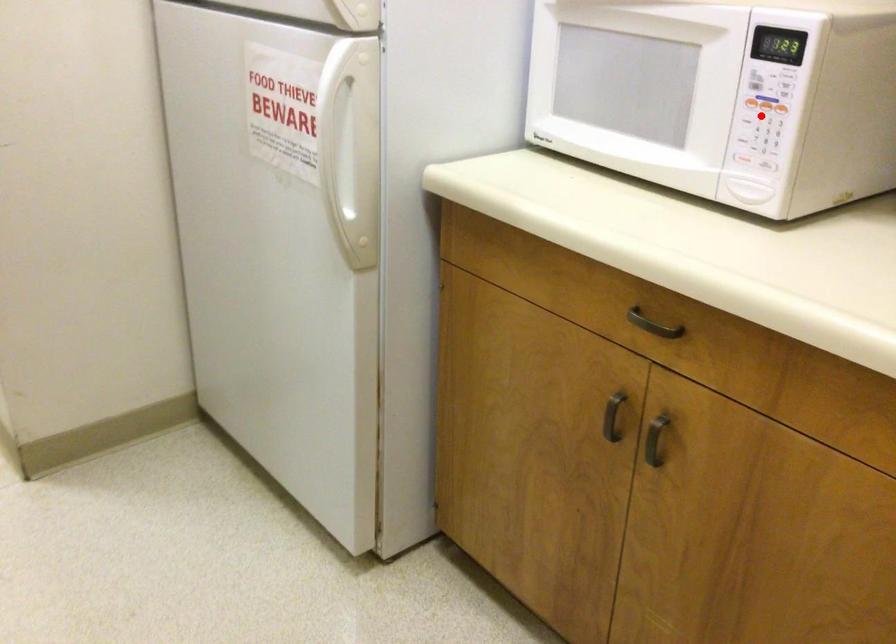
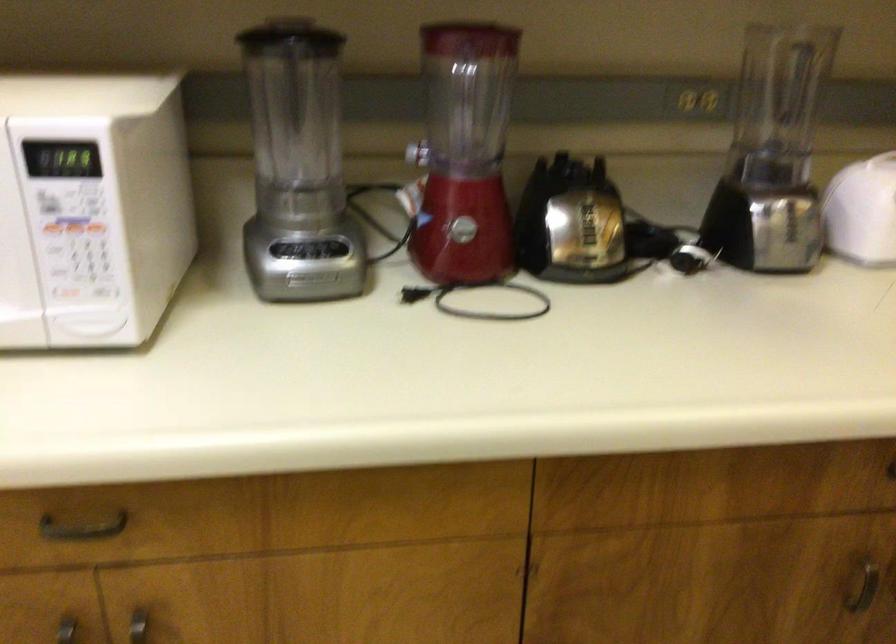
Question: A red point is marked in image1. In image2, is the corresponding 3D point closer to the camera or farther? Reply with the corresponding letter.

Choices:
 (A) The corresponding 3D point is closer.
 (B) The corresponding 3D point is farther.

Answer: (A)